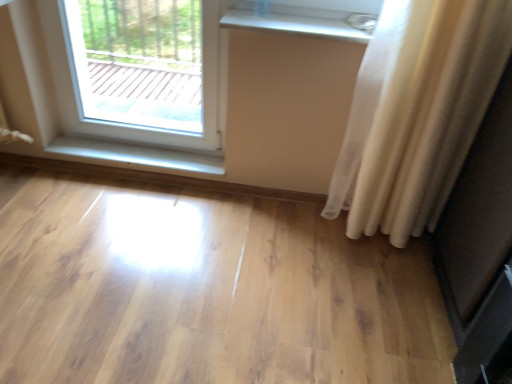
At what (x,y) coordinates should I click in order to perform the action: click on vacant space in front of white sheer curtain at right. Please return your answer as a coordinate pair (x, y). Looking at the image, I should click on (380, 296).